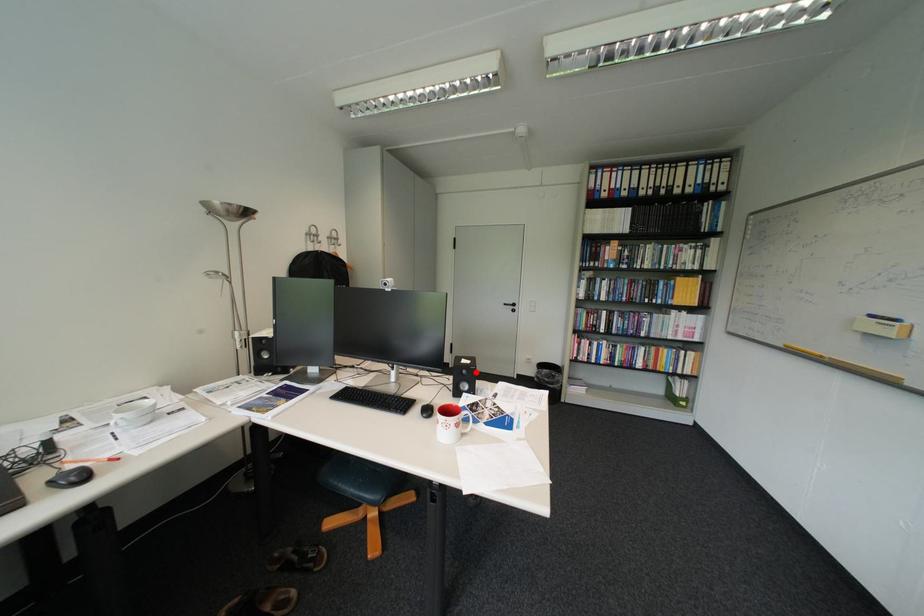
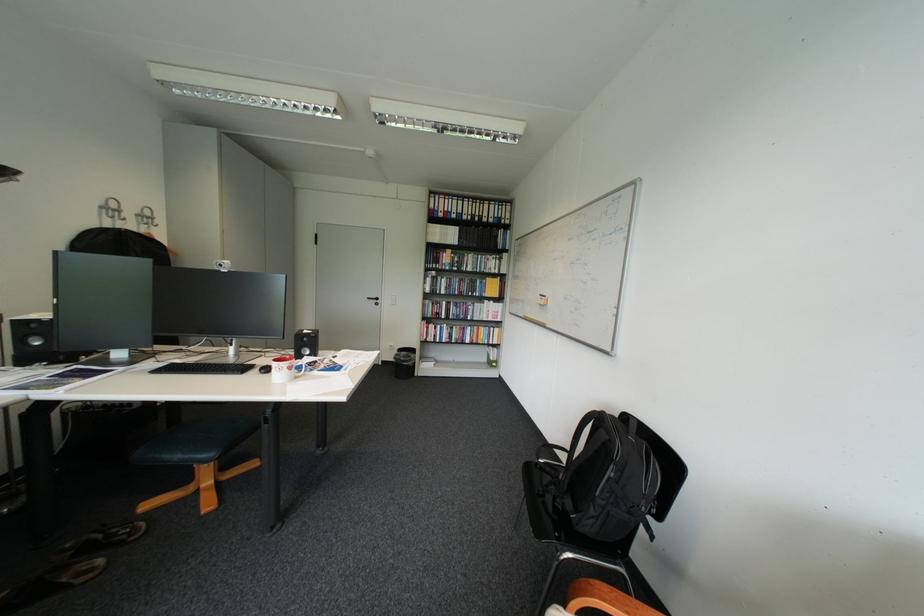
Locate, in the second image, the point that corresponds to the highlighted location in the first image.

(317, 339)